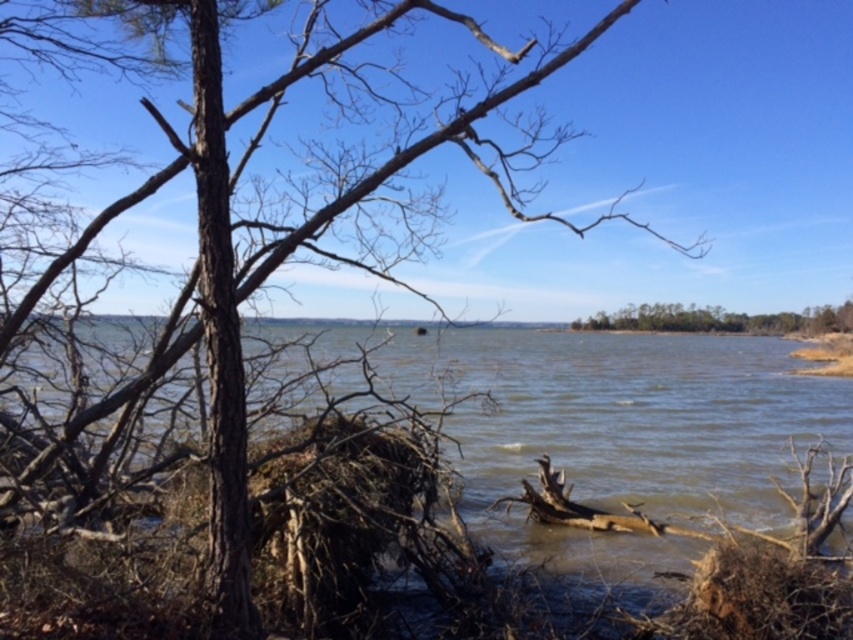
Question: Can you confirm if brown muddy water at center is wider than green leafy tree at center?

Choices:
 (A) no
 (B) yes

Answer: (B)

Question: Does brown muddy water at center have a larger size compared to green leafy tree at center?

Choices:
 (A) no
 (B) yes

Answer: (B)

Question: Can you confirm if brown muddy water at center is positioned to the right of green leafy tree at center?

Choices:
 (A) yes
 (B) no

Answer: (B)

Question: Which point is farther to the camera?

Choices:
 (A) brown muddy water at center
 (B) green leafy tree at center

Answer: (B)